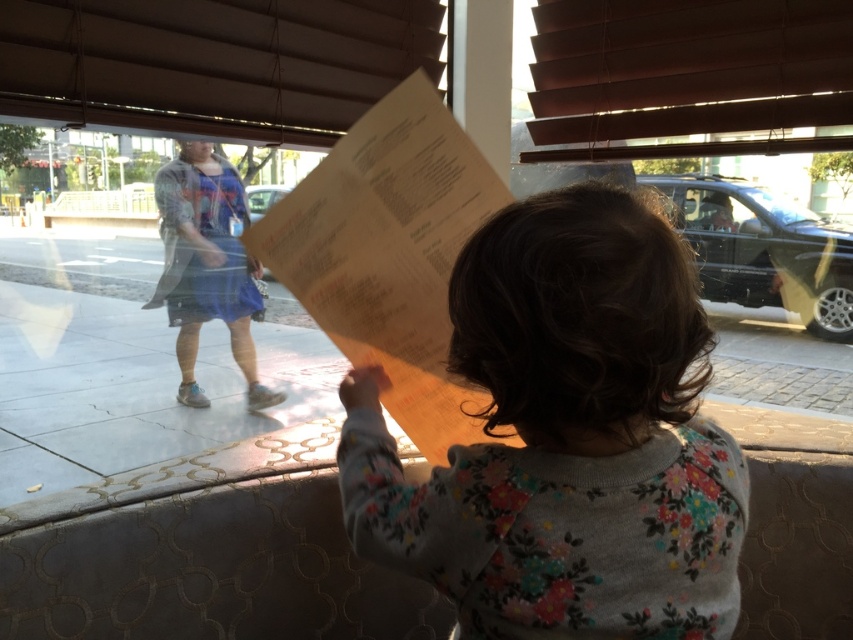
You are a customer in the cafe and want to place your coffee mug exactly where the fluffy gray sweater at center is located. Can you do that?

The position of fluffy gray sweater at center is at point [566,438], so yes, you can place your coffee mug there as it is a valid coordinate location.

You are a fashion designer observing a child in a cafe. The child is wearing a fluffy gray sweater at center and holding a menu. Nearby, a woman is wearing a blue fabric dress at center. Which clothing item is smaller in size?

The fluffy gray sweater at center is smaller in size compared to the blue fabric dress at center.

You are a photographer trying to capture the child on the patterned couch with a geometric design. The camera is set to focus on the point at point (705,445). Will the child be in focus?

The point at point (705,445) is 27.51 inches from the camera, so yes, the child will be in focus if the camera is focused on that point.